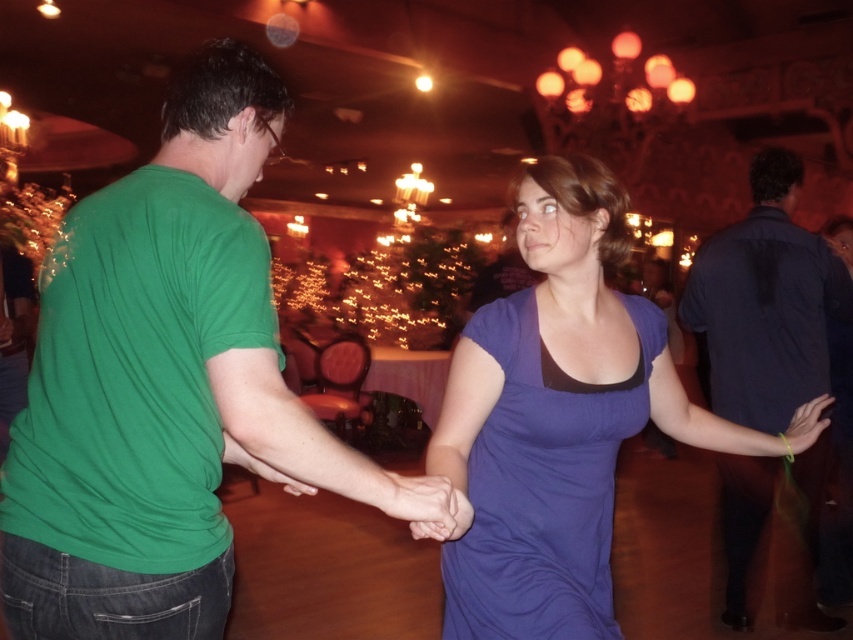
Question: Which object appears farthest from the camera in this image?

Choices:
 (A) purple satin dress at center
 (B) dark blue shirt at right

Answer: (B)

Question: Which object is closer to the camera taking this photo?

Choices:
 (A) purple satin dress at center
 (B) dark blue shirt at right

Answer: (A)

Question: Does purple soft fabric dress at center have a greater width compared to dark blue shirt at right?

Choices:
 (A) yes
 (B) no

Answer: (B)

Question: Is purple soft fabric dress at center below dark blue shirt at right?

Choices:
 (A) yes
 (B) no

Answer: (A)

Question: Considering the real-world distances, which object is farthest from the purple soft fabric dress at center?

Choices:
 (A) dark blue shirt at right
 (B) green cotton t-shirt at center
 (C) purple satin dress at center

Answer: (A)

Question: Where is purple satin dress at center located in relation to purple soft fabric dress at center in the image?

Choices:
 (A) right
 (B) left

Answer: (A)